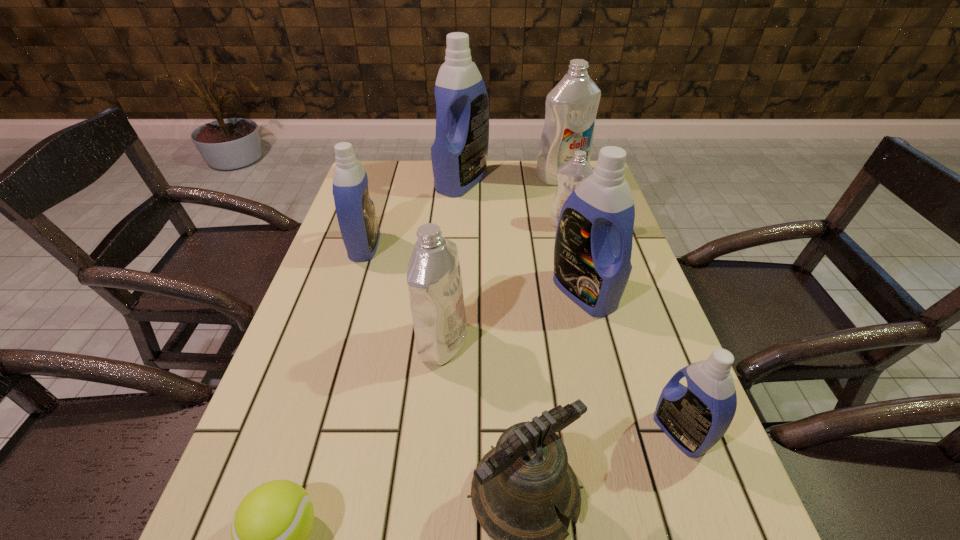
You are a GUI agent. You are given a task and a screenshot of the screen. Output one action in this format:
    pyautogui.click(x=<x>, y=<y>)
    Task: Click on the smallest blue detergent
    The height and width of the screenshot is (540, 960).
    Given the screenshot: What is the action you would take?
    pyautogui.click(x=695, y=418)

I want to click on vacant region located on the left of the biggest blue detergent, so click(358, 181).

Find the location of a particular element. The height and width of the screenshot is (540, 960). vacant space positioned on the front of the biggest white detergent is located at coordinates (579, 239).

Where is `vacant space located on the left of the second nearest blue detergent`? vacant space located on the left of the second nearest blue detergent is located at coordinates (519, 292).

Image resolution: width=960 pixels, height=540 pixels. In order to click on blank area located on the right of the leftmost white detergent in this screenshot , I will do `click(490, 342)`.

The image size is (960, 540). In order to click on blank space located on the front of the leftmost detergent in this screenshot , I will do `click(329, 359)`.

What are the coordinates of `vacant space located on the left of the second farthest white detergent` in the screenshot? It's located at (423, 224).

Locate an element on the screen. vacant space situated on the back of the smallest blue detergent is located at coordinates (643, 330).

Find the location of `object that is at the left edge`. object that is at the left edge is located at coordinates pyautogui.click(x=356, y=215).

Where is `object at the far right corner`? object at the far right corner is located at coordinates (571, 106).